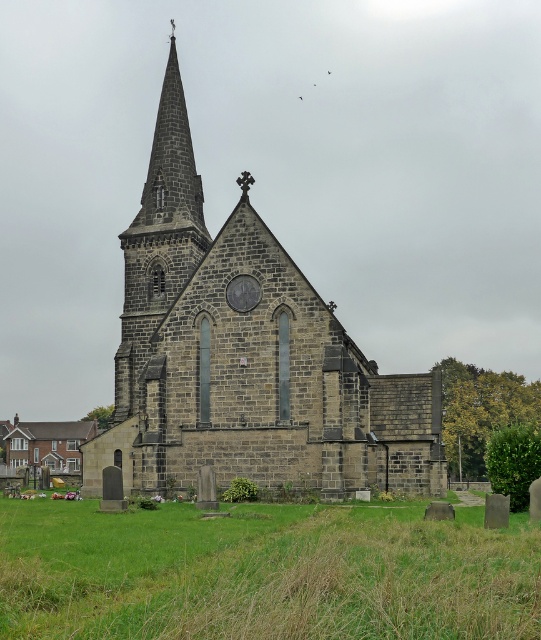
Question: Is dark gray stone church at center to the right of green grass at lower center from the viewer's perspective?

Choices:
 (A) yes
 (B) no

Answer: (B)

Question: Which point is closer to the camera?

Choices:
 (A) dark gray stone church at center
 (B) green grass at lower center

Answer: (B)

Question: Is dark gray stone church at center to the left of green grass at lower center from the viewer's perspective?

Choices:
 (A) no
 (B) yes

Answer: (B)

Question: In this image, where is dark gray stone church at center located relative to green grass at lower center?

Choices:
 (A) above
 (B) below

Answer: (A)